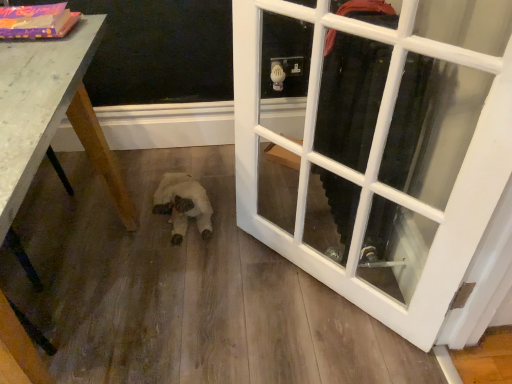
Locate an element on the screen. This screenshot has height=384, width=512. free space to the left of white plush toy at center is located at coordinates tap(134, 199).